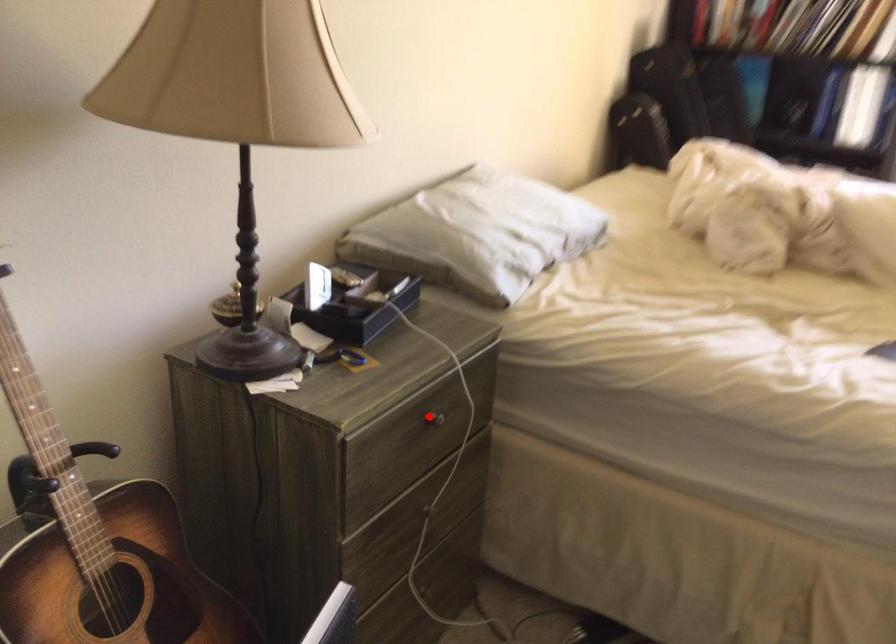
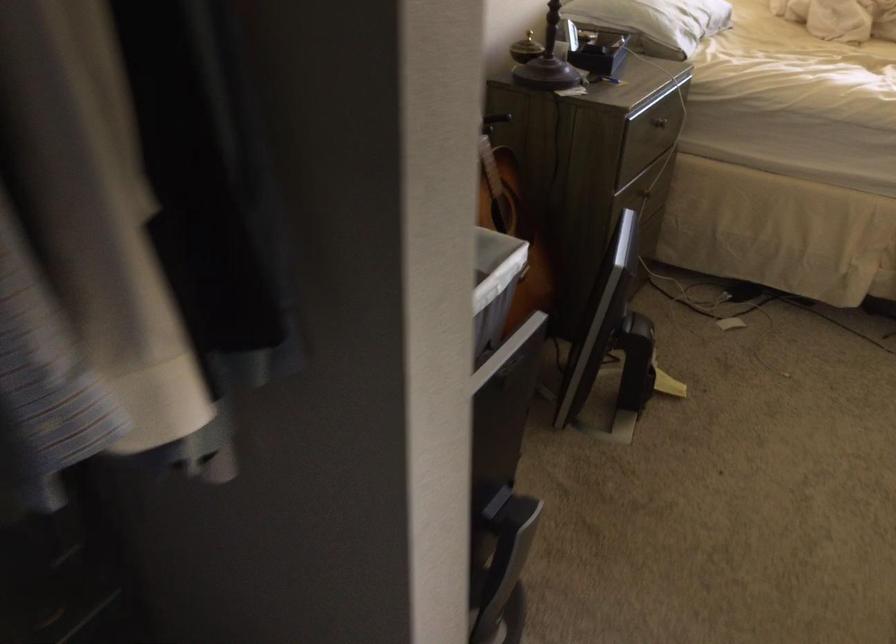
The point at the highlighted location is marked in the first image. Where is the corresponding point in the second image?

(659, 122)